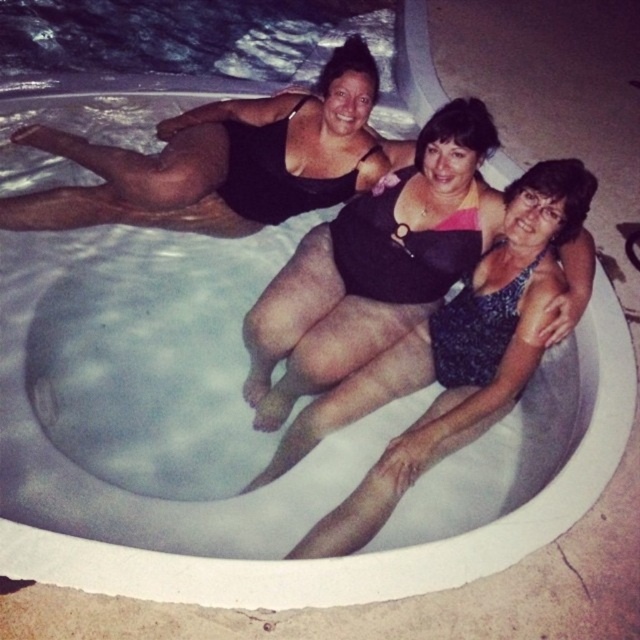
You are a photographer taking a photo of two women in a hot tub. You notice the black matte swimsuit at center and the black matte swimsuit at upper center. Which one appears taller in the photo?

The black matte swimsuit at center appears much taller than the black matte swimsuit at upper center in the photo.

Based on the photo, you are designing a new swimsuit collection and want to ensure proper sizing. You have two black matte swimsuits in your design sketches. The first is labeled as the black matte swimsuit at center, and the second is the black matte swimsuit at upper center. Based on the image description, which swimsuit is narrower in width?

The black matte swimsuit at center is thinner than the black matte swimsuit at upper center, so the swimsuit labeled black matte swimsuit at center is narrower in width.

You are standing in front of the hot tub and notice two points marked in the scene. Which point, point (x=353, y=291) or point (x=365, y=156), is closer to you?

Point (x=353, y=291) is closer to the viewer than point (x=365, y=156).